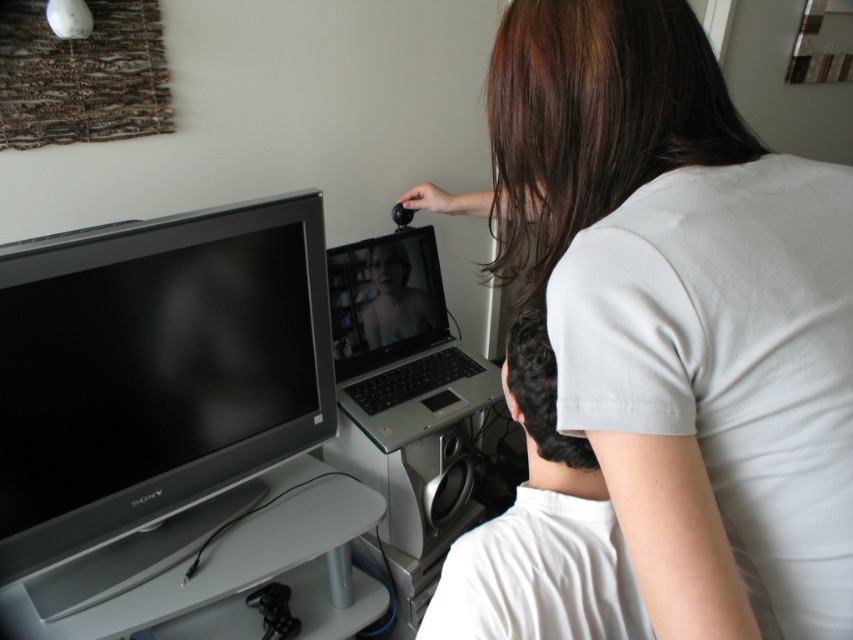
Question: Does silver metallic flat-screen tv at left appear on the left side of silver/black laptop at center?

Choices:
 (A) yes
 (B) no

Answer: (A)

Question: Which point is closer to the camera taking this photo?

Choices:
 (A) (154, 506)
 (B) (430, 312)
 (C) (378, 252)

Answer: (A)

Question: Is white matte shirt at upper right wider than matte white laptop at center?

Choices:
 (A) yes
 (B) no

Answer: (A)

Question: Which point is closer to the camera taking this photo?

Choices:
 (A) (660, 266)
 (B) (639, 611)
 (C) (212, 374)
 (D) (374, 339)

Answer: (A)

Question: Which point is farther from the camera taking this photo?

Choices:
 (A) (552, 96)
 (B) (26, 474)

Answer: (B)

Question: Where is silver metallic flat-screen tv at left located in relation to matte white laptop at center in the image?

Choices:
 (A) left
 (B) right

Answer: (A)